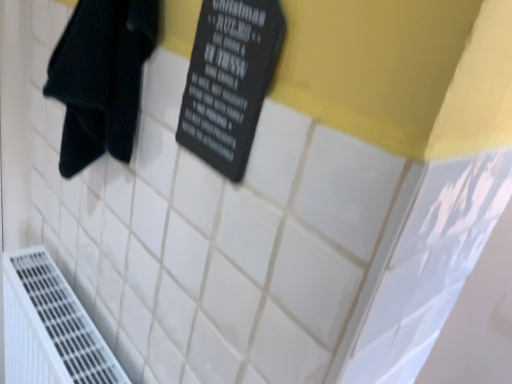
Question: Does black matte sign at upper center turn towards black fabric towel at left?

Choices:
 (A) yes
 (B) no

Answer: (B)

Question: Considering the relative sizes of black matte sign at upper center and black fabric towel at left in the image provided, is black matte sign at upper center smaller than black fabric towel at left?

Choices:
 (A) yes
 (B) no

Answer: (A)

Question: From a real-world perspective, does black matte sign at upper center stand above black fabric towel at left?

Choices:
 (A) yes
 (B) no

Answer: (A)

Question: Can you confirm if black matte sign at upper center is bigger than black fabric towel at left?

Choices:
 (A) yes
 (B) no

Answer: (B)

Question: From a real-world perspective, is black matte sign at upper center below black fabric towel at left?

Choices:
 (A) yes
 (B) no

Answer: (B)

Question: From the image's perspective, is black matte sign at upper center positioned above or below black fabric towel at left?

Choices:
 (A) above
 (B) below

Answer: (A)

Question: Is black matte sign at upper center taller or shorter than black fabric towel at left?

Choices:
 (A) tall
 (B) short

Answer: (A)

Question: Is black matte sign at upper center to the left or to the right of black fabric towel at left in the image?

Choices:
 (A) left
 (B) right

Answer: (B)

Question: Does point (203, 105) appear closer or farther from the camera than point (96, 34)?

Choices:
 (A) farther
 (B) closer

Answer: (B)

Question: From a real-world perspective, is white plastic air conditioning at lower left positioned above or below black matte sign at upper center?

Choices:
 (A) below
 (B) above

Answer: (A)

Question: Choose the correct answer: Is white plastic air conditioning at lower left inside black matte sign at upper center or outside it?

Choices:
 (A) inside
 (B) outside

Answer: (B)

Question: In terms of width, does white plastic air conditioning at lower left look wider or thinner when compared to black matte sign at upper center?

Choices:
 (A) wide
 (B) thin

Answer: (A)

Question: Looking at the image, does white plastic air conditioning at lower left seem bigger or smaller compared to black matte sign at upper center?

Choices:
 (A) small
 (B) big

Answer: (B)

Question: From the image's perspective, is white plastic air conditioning at lower left above or below black fabric towel at left?

Choices:
 (A) above
 (B) below

Answer: (B)

Question: Based on their sizes in the image, would you say white plastic air conditioning at lower left is bigger or smaller than black fabric towel at left?

Choices:
 (A) small
 (B) big

Answer: (B)